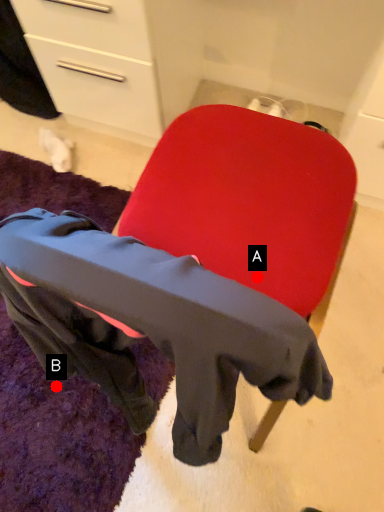
Question: Two points are circled on the image, labeled by A and B beside each circle. Which point is closer to the camera taking this photo?

Choices:
 (A) A is closer
 (B) B is closer

Answer: (A)